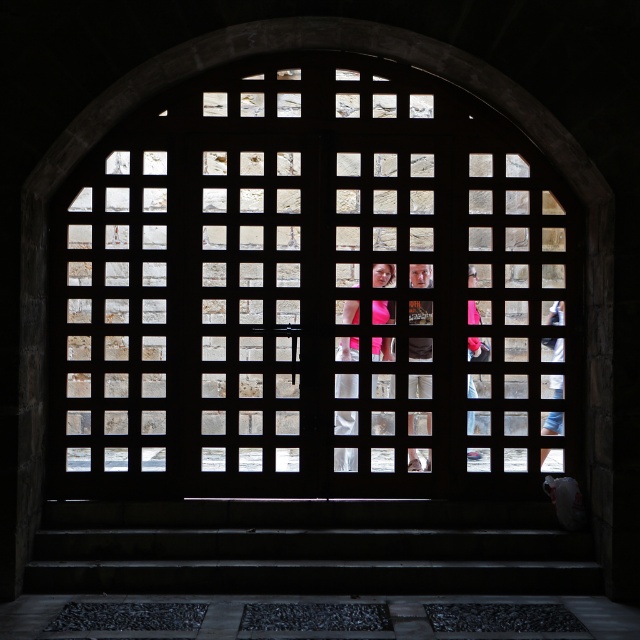
Question: Does matte pink dress at center have a greater width compared to pink fabric at center?

Choices:
 (A) yes
 (B) no

Answer: (A)

Question: Which object is the farthest from the pink fabric at center?

Choices:
 (A) wooden lattice at center
 (B) matte pink dress at center

Answer: (A)

Question: Can you confirm if wooden lattice at center is positioned above matte pink dress at center?

Choices:
 (A) no
 (B) yes

Answer: (B)

Question: Estimate the real-world distances between objects in this image. Which object is closer to the wooden lattice at center?

Choices:
 (A) matte pink dress at center
 (B) pink fabric at center

Answer: (A)

Question: Which point is farther from the camera taking this photo?

Choices:
 (A) (481, 342)
 (B) (102, 294)
 (C) (372, 278)

Answer: (A)

Question: Does matte pink dress at center have a greater width compared to pink fabric at center?

Choices:
 (A) no
 (B) yes

Answer: (B)